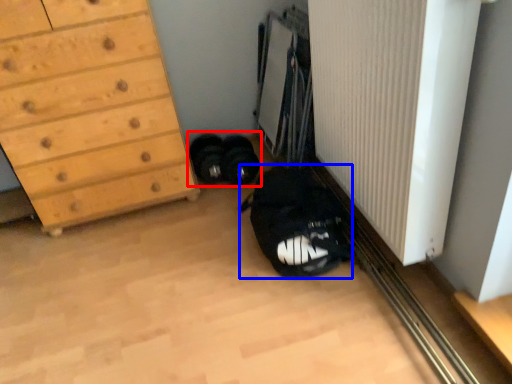
Question: Which of the following is the farthest to the observer, footwear (highlighted by a red box) or shoulder bag (highlighted by a blue box)?

Choices:
 (A) footwear
 (B) shoulder bag

Answer: (A)